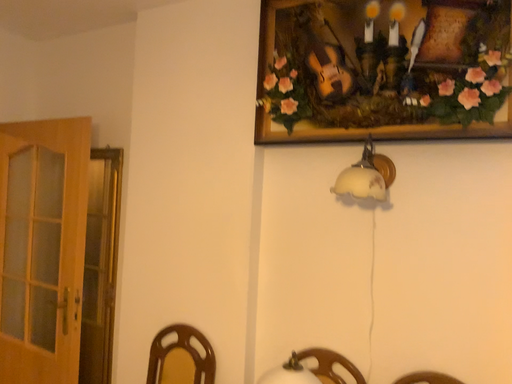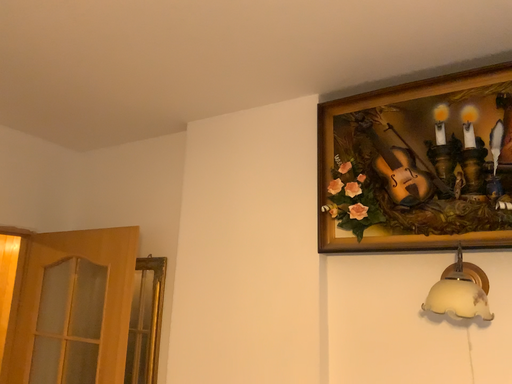
Question: Which way did the camera rotate in the video?

Choices:
 (A) rotated upward
 (B) rotated downward

Answer: (A)